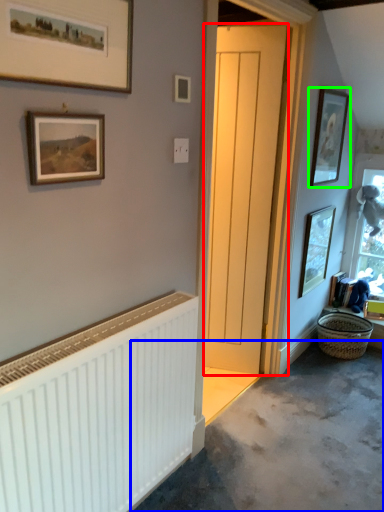
Question: Estimate the real-world distances between objects in this image. Which object is farther from door (highlighted by a red box), concrete (highlighted by a blue box) or picture frame (highlighted by a green box)?

Choices:
 (A) concrete
 (B) picture frame

Answer: (A)